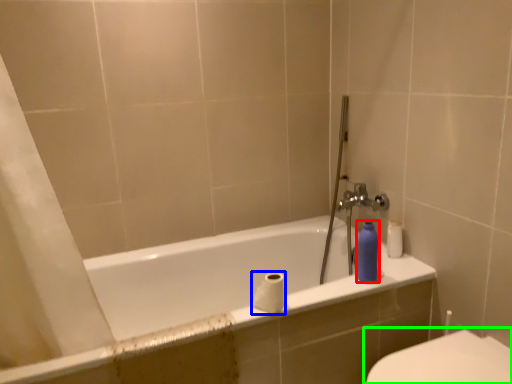
Question: Estimate the real-world distances between objects in this image. Which object is closer to toiletry (highlighted by a red box), toilet paper (highlighted by a blue box) or toilet (highlighted by a green box)?

Choices:
 (A) toilet paper
 (B) toilet

Answer: (A)